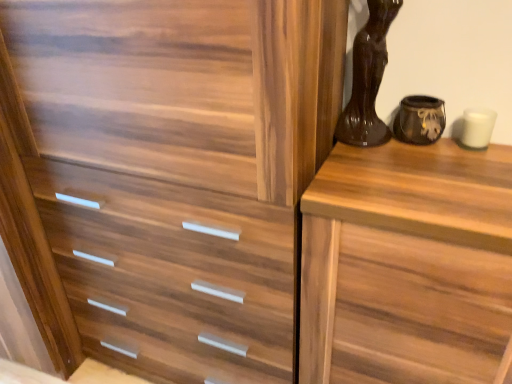
Question: From a real-world perspective, relative to wooden chest of drawers at right, is matte black vase at upper right, arranged as the 2th vase when viewed from the left, vertically above or below?

Choices:
 (A) above
 (B) below

Answer: (A)

Question: Relative to wooden chest of drawers at right, is matte black vase at upper right, marked as the 1th vase in a right-to-left arrangement, in front or behind?

Choices:
 (A) front
 (B) behind

Answer: (B)

Question: Which of these objects is positioned farthest from the matte black vase at upper right, marked as the 1th vase in a right-to-left arrangement?

Choices:
 (A) shiny brown vase at upper right, which is the 2th vase in right-to-left order
 (B) wooden chest of drawers at right

Answer: (B)

Question: Which object is the farthest from the wooden chest of drawers at right?

Choices:
 (A) matte black vase at upper right, marked as the 1th vase in a right-to-left arrangement
 (B) shiny brown vase at upper right, which is the 2th vase in right-to-left order

Answer: (A)